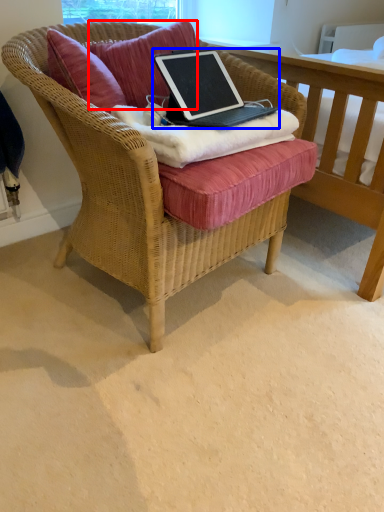
Question: Which object is closer to the camera taking this photo, pillow (highlighted by a red box) or laptop (highlighted by a blue box)?

Choices:
 (A) pillow
 (B) laptop

Answer: (B)